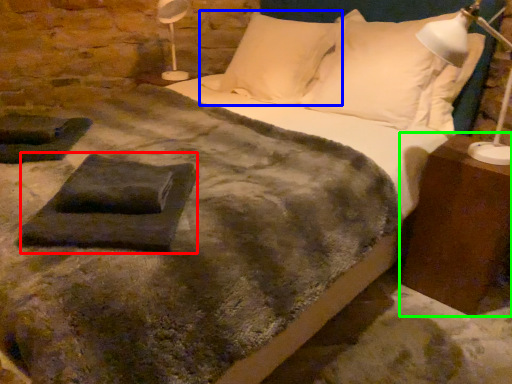
Question: Estimate the real-world distances between objects in this image. Which object is farther from slate (highlighted by a red box), pillow (highlighted by a blue box) or nightstand (highlighted by a green box)?

Choices:
 (A) pillow
 (B) nightstand

Answer: (A)